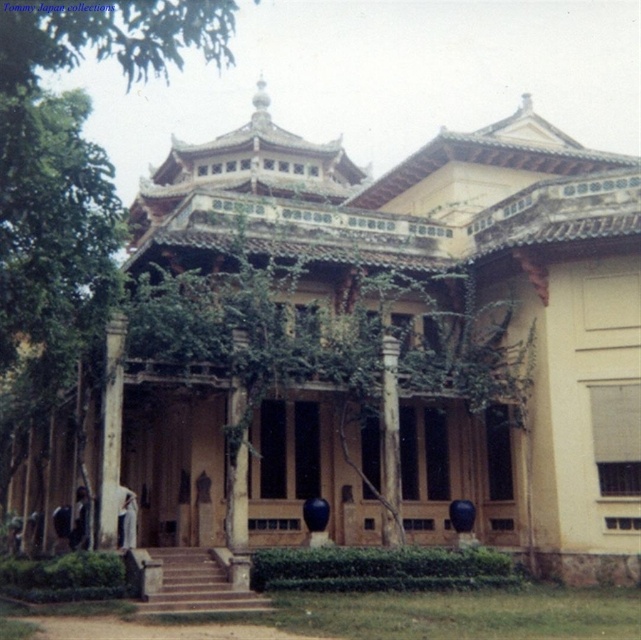
Does green leafy tree at lower left come behind smooth stone column at center?

No.

Can you confirm if green leafy tree at lower left is taller than smooth stone column at center?

Yes.

Who is more forward, (60, 291) or (106, 456)?

Positioned in front is point (60, 291).

Locate an element on the screen. The image size is (641, 640). green leafy tree at lower left is located at coordinates (72, 156).